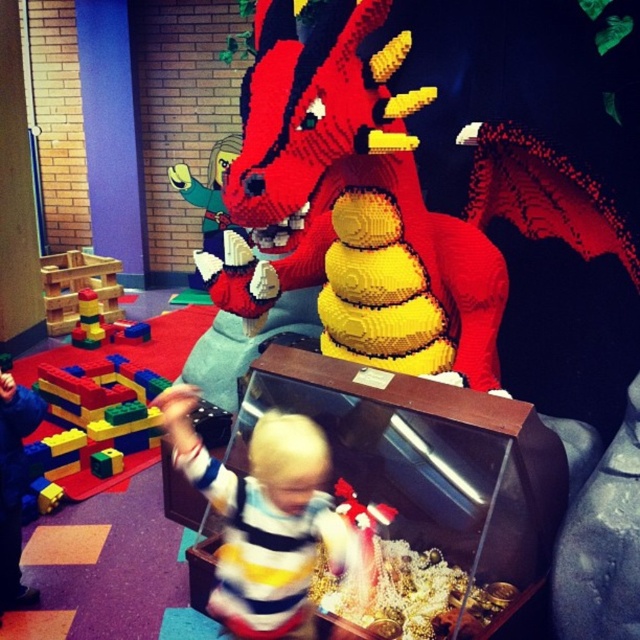
The width and height of the screenshot is (640, 640). What do you see at coordinates (262, 518) in the screenshot?
I see `striped cotton shirt at center` at bounding box center [262, 518].

Is point (342, 557) closer to camera compared to point (93, 326)?

Yes, point (342, 557) is closer to viewer.

This screenshot has width=640, height=640. What are the coordinates of `striped cotton shirt at center` in the screenshot? It's located at (262, 518).

Locate an element on the screen. This screenshot has width=640, height=640. striped cotton shirt at center is located at coordinates (262, 518).

Does striped cotton shirt at center have a larger size compared to wooden blocks at left?

No, striped cotton shirt at center is not bigger than wooden blocks at left.

Based on the photo, can you confirm if striped cotton shirt at center is shorter than wooden blocks at left?

No, striped cotton shirt at center is not shorter than wooden blocks at left.

Between point (305, 609) and point (76, 288), which one is positioned in front?

Point (305, 609) is in front.

This screenshot has width=640, height=640. I want to click on striped cotton shirt at center, so click(262, 518).

Can you confirm if wooden blocks at left is taller than brick-like plastic blocks at left?

Yes, wooden blocks at left is taller than brick-like plastic blocks at left.

Does point (65, 317) come in front of point (86, 342)?

No, it is behind (86, 342).

You are a GUI agent. You are given a task and a screenshot of the screen. Output one action in this format:
    pyautogui.click(x=<x>, y=<y>)
    Task: Click on the wooden blocks at left
    The image size is (640, 640).
    Given the screenshot: What is the action you would take?
    pyautogui.click(x=77, y=288)